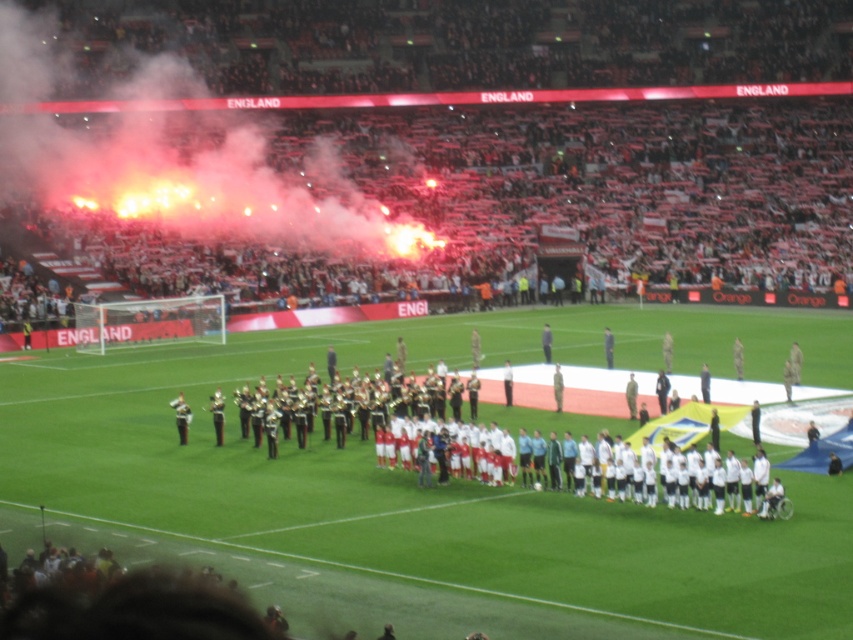
In the scene shown: You are a photographer at the stadium and want to capture a photo that includes both the red smoke at upper left and the white fabric football team at center. Which object should you focus on first to ensure both are in frame?

The red smoke at upper left is bigger than the white fabric football team at center, so you should focus on the red smoke at upper left first to ensure both are in frame.